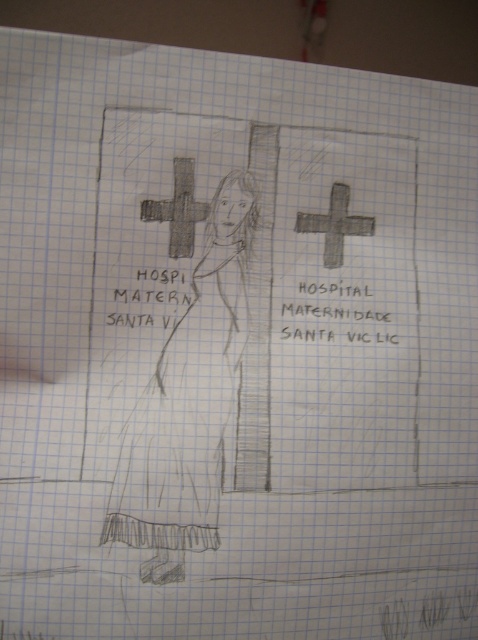
Question: Which point is farther to the camera?

Choices:
 (A) gray textured cross at center
 (B) matte black dress at center

Answer: (A)

Question: Where is charcoal textured cross at center located in relation to gray textured cross at center in the image?

Choices:
 (A) left
 (B) right

Answer: (A)

Question: Can you confirm if matte black dress at center is positioned to the left of gray textured cross at center?

Choices:
 (A) no
 (B) yes

Answer: (B)

Question: Which point appears farthest from the camera in this image?

Choices:
 (A) (228, 349)
 (B) (349, 216)
 (C) (178, 193)

Answer: (B)

Question: Which point is farther to the camera?

Choices:
 (A) (175, 230)
 (B) (224, 305)
 (C) (336, 218)

Answer: (C)

Question: Is charcoal textured cross at center to the right of gray textured cross at center from the viewer's perspective?

Choices:
 (A) no
 (B) yes

Answer: (A)